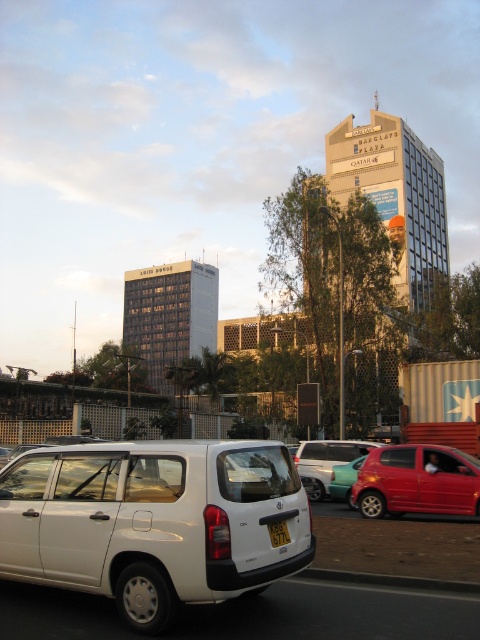
Who is taller, glossy red car at lower right or metallic silver car at center?

metallic silver car at center

Which is above, glossy red car at lower right or metallic silver car at center?

glossy red car at lower right is higher up.

The height and width of the screenshot is (640, 480). What do you see at coordinates (417, 481) in the screenshot?
I see `glossy red car at lower right` at bounding box center [417, 481].

You are a GUI agent. You are given a task and a screenshot of the screen. Output one action in this format:
    pyautogui.click(x=<x>, y=<y>)
    Task: Click on the glossy red car at lower right
    The image size is (480, 640).
    Given the screenshot: What is the action you would take?
    pyautogui.click(x=417, y=481)

Is white matte van at lower left further to camera compared to yellow matte license plate at center?

No.

In order to click on white matte van at lower left in this screenshot , I will do `click(154, 522)`.

I want to click on white matte van at lower left, so click(x=154, y=522).

Locate an element on the screen. The width and height of the screenshot is (480, 640). white matte van at lower left is located at coordinates click(154, 522).

Between white matte van at lower left and glossy red car at lower right, which one is positioned higher?

white matte van at lower left is above.

Locate an element on the screen. white matte van at lower left is located at coordinates (154, 522).